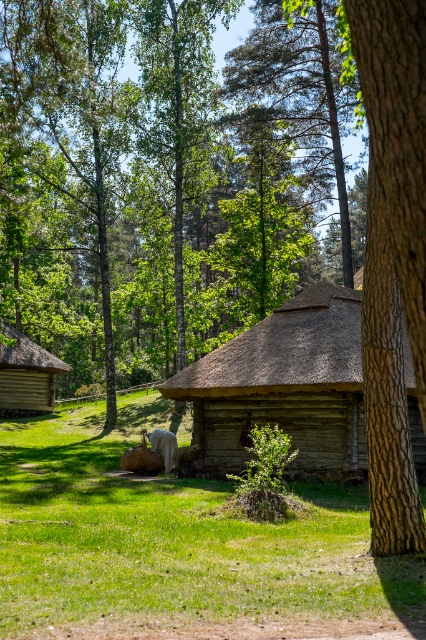
Looking at this image, is wooden log cabin at center above wooden cabin at left?

Indeed, wooden log cabin at center is positioned over wooden cabin at left.

Does wooden log cabin at center have a greater height compared to wooden cabin at left?

Yes, wooden log cabin at center is taller than wooden cabin at left.

At what (x,y) coordinates should I click in order to perform the action: click on wooden log cabin at center. Please return your answer as a coordinate pair (x, y). This screenshot has height=640, width=426. Looking at the image, I should click on (284, 387).

Is green grass at center behind wooden log cabin at center?

No, it is in front of wooden log cabin at center.

Identify the location of green grass at center. (170, 538).

Image resolution: width=426 pixels, height=640 pixels. I want to click on green grass at center, so click(170, 538).

Does brown rough bark tree at center appear on the right side of wooden cabin at left?

Correct, you'll find brown rough bark tree at center to the right of wooden cabin at left.

Between point (417, 264) and point (55, 369), which one is positioned behind?

The point (55, 369) is more distant.

The height and width of the screenshot is (640, 426). I want to click on brown rough bark tree at center, so click(393, 257).

Identify the location of brown rough bark tree at center. The height and width of the screenshot is (640, 426). (393, 257).